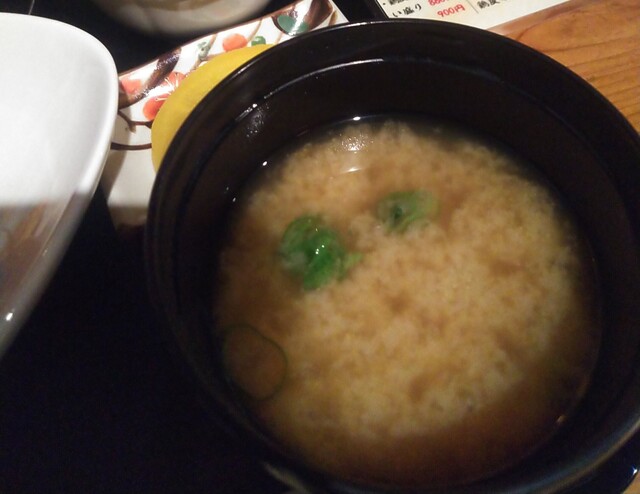
Where is `white dish`? white dish is located at coordinates (76, 74).